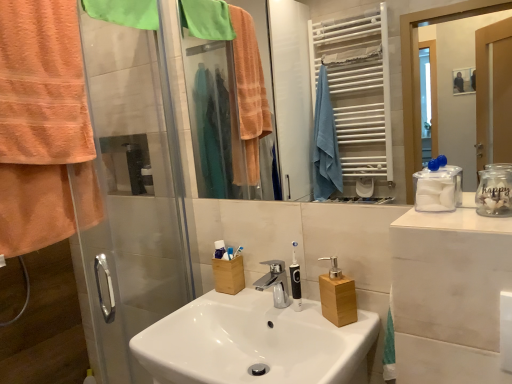
Question: Can you confirm if green fabric towel at upper left, the 2th towel/napkin ordered from the bottom, is bigger than transparent plastic container at right?

Choices:
 (A) no
 (B) yes

Answer: (B)

Question: Is green fabric towel at upper left, placed as the first towel/napkin when sorted from top to bottom, looking in the opposite direction of transparent plastic container at right?

Choices:
 (A) yes
 (B) no

Answer: (B)

Question: Considering the relative positions of green fabric towel at upper left, placed as the first towel/napkin when sorted from top to bottom, and transparent plastic container at right in the image provided, is green fabric towel at upper left, placed as the first towel/napkin when sorted from top to bottom, to the left of transparent plastic container at right from the viewer's perspective?

Choices:
 (A) no
 (B) yes

Answer: (B)

Question: Is green fabric towel at upper left, placed as the first towel/napkin when sorted from top to bottom, placed right next to transparent plastic container at right?

Choices:
 (A) yes
 (B) no

Answer: (B)

Question: Considering the relative sizes of green fabric towel at upper left, the 2th towel/napkin ordered from the bottom, and transparent plastic container at right in the image provided, is green fabric towel at upper left, the 2th towel/napkin ordered from the bottom, thinner than transparent plastic container at right?

Choices:
 (A) yes
 (B) no

Answer: (A)

Question: From the image's perspective, does green fabric towel at upper left, the 2th towel/napkin ordered from the bottom, appear lower than transparent plastic container at right?

Choices:
 (A) yes
 (B) no

Answer: (B)

Question: Can you confirm if white plastic toothbrush at center, the 1th toothbrush from the right, is bigger than wooden soap dispenser at center, which ranks as the first bottle in bottom-to-top order?

Choices:
 (A) yes
 (B) no

Answer: (B)

Question: From the image's perspective, is white plastic toothbrush at center, which is counted as the second toothbrush, starting from the left, above wooden soap dispenser at center, which ranks as the first bottle in bottom-to-top order?

Choices:
 (A) yes
 (B) no

Answer: (A)

Question: Is white plastic toothbrush at center, which is counted as the second toothbrush, starting from the left, facing away from wooden soap dispenser at center, which ranks as the second bottle in front-to-back order?

Choices:
 (A) yes
 (B) no

Answer: (B)

Question: Does white plastic toothbrush at center, the 1th toothbrush from the right, contain wooden soap dispenser at center, the 1th bottle positioned from the back?

Choices:
 (A) no
 (B) yes

Answer: (A)

Question: Considering the relative positions of white plastic toothbrush at center, the 1th toothbrush from the right, and wooden soap dispenser at center, the second bottle in the top-to-bottom sequence, in the image provided, is white plastic toothbrush at center, the 1th toothbrush from the right, to the right of wooden soap dispenser at center, the second bottle in the top-to-bottom sequence, from the viewer's perspective?

Choices:
 (A) yes
 (B) no

Answer: (B)

Question: Can you confirm if white plastic toothbrush at center, the 1th toothbrush from the right, is shorter than wooden soap dispenser at center, which ranks as the second bottle in front-to-back order?

Choices:
 (A) yes
 (B) no

Answer: (A)

Question: From the image's perspective, is orange terry cloth towel at left, the second towel/napkin viewed from the top, on white plastic toothbrush at center, the 1th toothbrush from the right?

Choices:
 (A) yes
 (B) no

Answer: (A)